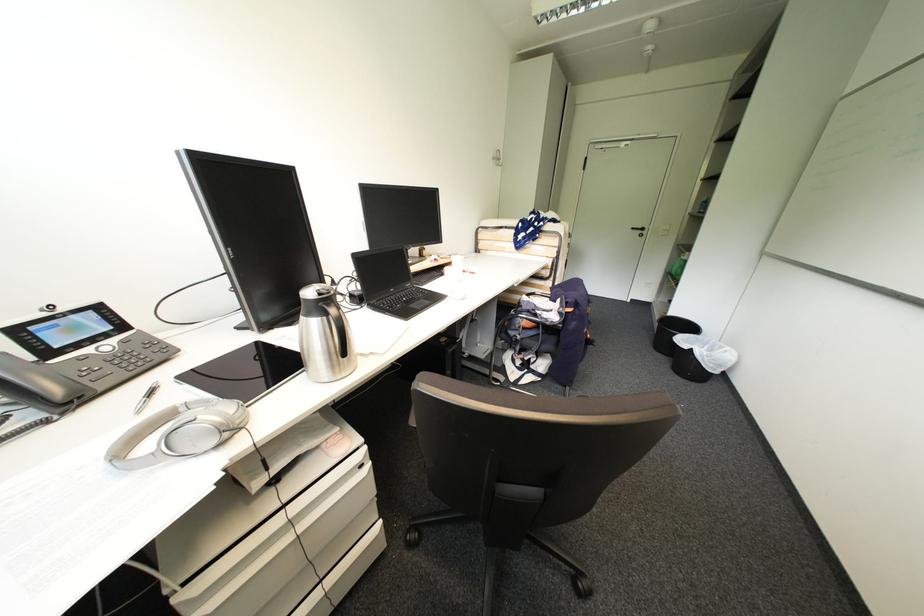
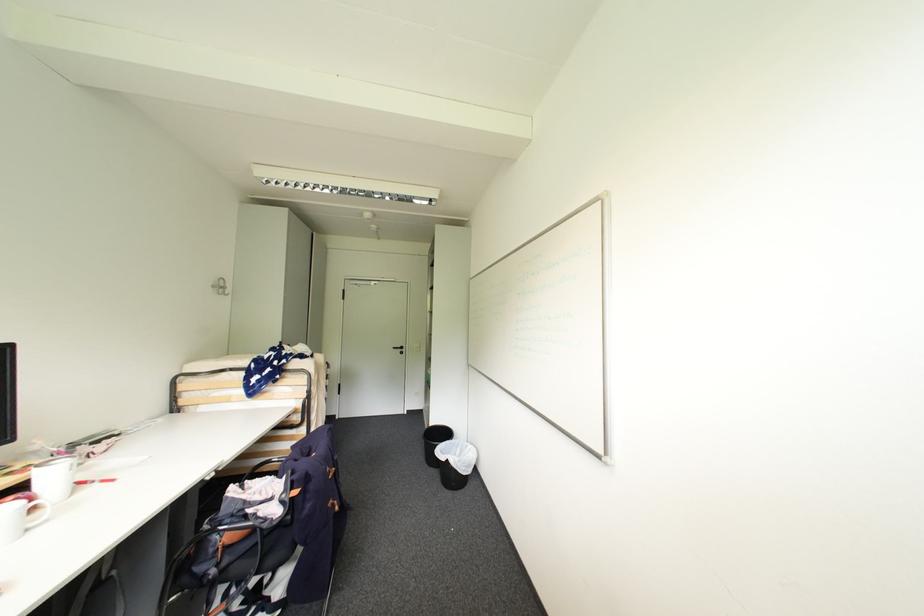
Locate, in the second image, the point that corresponds to (639,230) in the first image.

(400, 349)